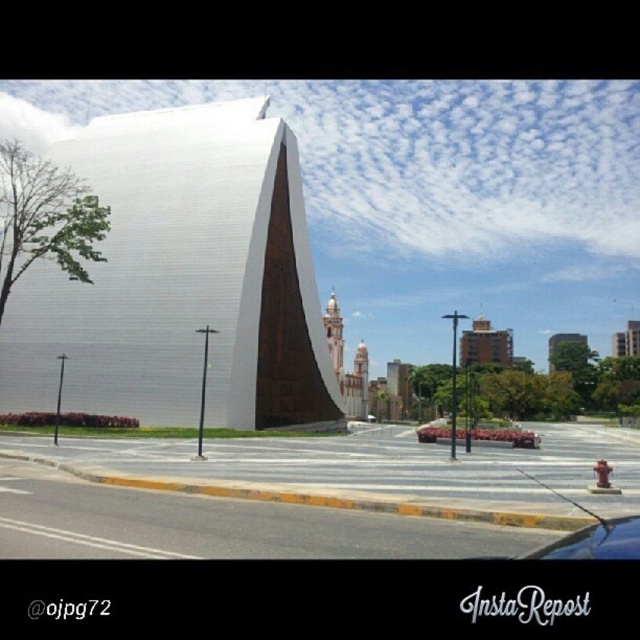
Question: Which object appears farthest from the camera in this image?

Choices:
 (A) green matte car at center
 (B) green textured tree at upper center
 (C) white matte building at center
 (D) brown brick building at center

Answer: (B)

Question: Which object appears closest to the camera in this image?

Choices:
 (A) green matte car at center
 (B) brown brick building at center

Answer: (A)

Question: Observing the image, what is the correct spatial positioning of green matte car at center in reference to green textured tree at upper center?

Choices:
 (A) right
 (B) left

Answer: (B)

Question: Estimate the real-world distances between objects in this image. Which object is farther from the white concrete building at upper right?

Choices:
 (A) white matte building at center
 (B) shiny black car at lower right

Answer: (B)

Question: Does brown brick building at center appear on the right side of green textured tree at upper center?

Choices:
 (A) no
 (B) yes

Answer: (A)

Question: Does white matte building at center appear under brown brick building at center?

Choices:
 (A) yes
 (B) no

Answer: (B)